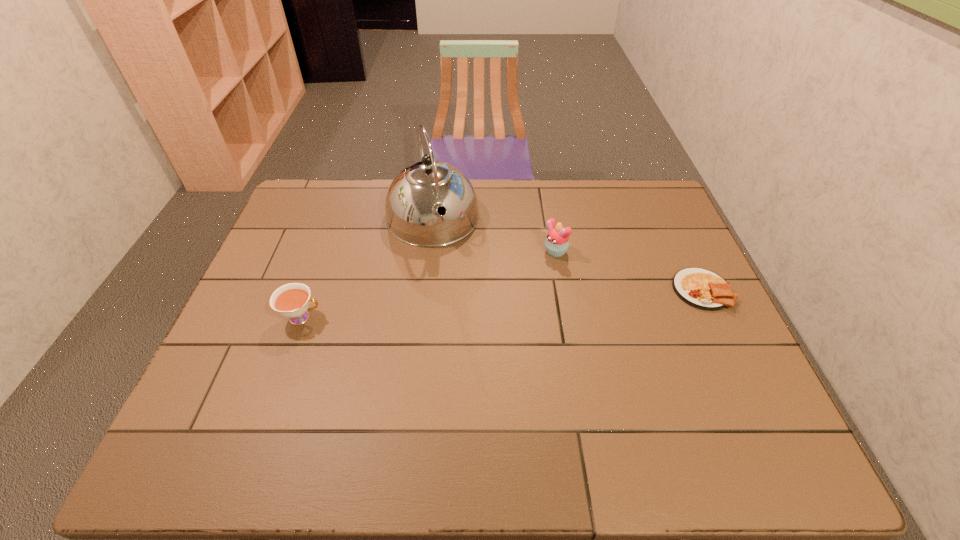
I want to click on vacant space located 0.330m from the spout of the second object from left to right, so click(472, 335).

This screenshot has width=960, height=540. I want to click on free point located from the spout of the second object from left to right, so click(452, 279).

The width and height of the screenshot is (960, 540). I want to click on vacant region located from the spout of the second object from left to right, so click(x=449, y=269).

You are a GUI agent. You are given a task and a screenshot of the screen. Output one action in this format:
    pyautogui.click(x=<x>, y=<y>)
    Task: Click on the free spot located 0.070m on the face of the cupcake
    The image size is (960, 540).
    Given the screenshot: What is the action you would take?
    pyautogui.click(x=528, y=271)

The image size is (960, 540). I want to click on vacant space situated on the face of the cupcake, so click(439, 332).

This screenshot has height=540, width=960. Find the location of `vacant area situated 0.330m on the face of the cupcake`. vacant area situated 0.330m on the face of the cupcake is located at coordinates (460, 318).

At what (x,y) coordinates should I click in order to perform the action: click on object that is at the far edge. Please return your answer as a coordinate pair (x, y). The height and width of the screenshot is (540, 960). Looking at the image, I should click on (412, 201).

Find the location of a particular element. object positioned at the left edge is located at coordinates (291, 300).

Find the location of a particular element. object at the right edge is located at coordinates (700, 288).

Identify the location of free spot at the far edge of the desktop. The image size is (960, 540). (527, 211).